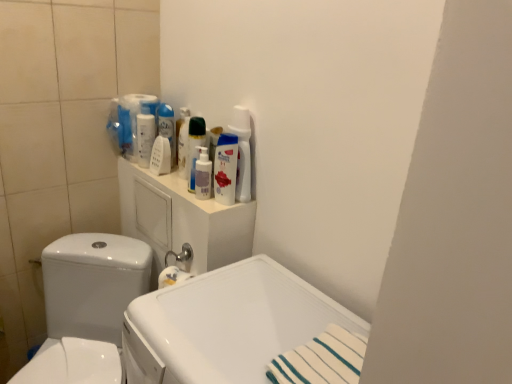
Question: Are white glossy bottle at upper center, which is counted as the 1th cleaning product, starting from the right, and white glossy mouthwash at upper center, marked as the second mouthwash in a right-to-left arrangement, beside each other?

Choices:
 (A) no
 (B) yes

Answer: (A)

Question: Considering the relative sizes of white glossy bottle at upper center, which is counted as the 1th cleaning product, starting from the right, and white glossy mouthwash at upper center, which is the first mouthwash in left-to-right order, in the image provided, is white glossy bottle at upper center, which is counted as the 1th cleaning product, starting from the right, bigger than white glossy mouthwash at upper center, which is the first mouthwash in left-to-right order,?

Choices:
 (A) no
 (B) yes

Answer: (B)

Question: From a real-world perspective, is white glossy bottle at upper center, acting as the fourth cleaning product starting from the left, physically above white glossy mouthwash at upper center, which is the first mouthwash in left-to-right order?

Choices:
 (A) yes
 (B) no

Answer: (B)

Question: Is white glossy bottle at upper center, which is counted as the 1th cleaning product, starting from the right, surrounding white glossy mouthwash at upper center, which is the first mouthwash in left-to-right order?

Choices:
 (A) no
 (B) yes

Answer: (A)

Question: Is white glossy bottle at upper center, acting as the fourth cleaning product starting from the left, facing towards white glossy mouthwash at upper center, which is the first mouthwash in left-to-right order?

Choices:
 (A) no
 (B) yes

Answer: (A)

Question: From a real-world perspective, is white glossy bottle at upper center, which is counted as the 1th cleaning product, starting from the right, under white glossy mouthwash at upper center, which appears as the second mouthwash when viewed from the front?

Choices:
 (A) yes
 (B) no

Answer: (A)

Question: Can you confirm if white plastic medicine cabinet at upper center is positioned to the right of white glossy mouthwash at upper center, which appears as the second mouthwash when viewed from the front?

Choices:
 (A) no
 (B) yes

Answer: (B)

Question: From a real-world perspective, is white plastic medicine cabinet at upper center on white glossy mouthwash at upper center, which is the first mouthwash in left-to-right order?

Choices:
 (A) no
 (B) yes

Answer: (A)

Question: Does white plastic medicine cabinet at upper center turn towards white glossy mouthwash at upper center, which is the first mouthwash in left-to-right order?

Choices:
 (A) yes
 (B) no

Answer: (B)

Question: Is white plastic medicine cabinet at upper center shorter than white glossy mouthwash at upper center, which is the first mouthwash in left-to-right order?

Choices:
 (A) yes
 (B) no

Answer: (B)

Question: From the image's perspective, does white plastic medicine cabinet at upper center appear higher than white glossy mouthwash at upper center, positioned as the 1th mouthwash in back-to-front order?

Choices:
 (A) no
 (B) yes

Answer: (A)

Question: Considering the relative sizes of white plastic medicine cabinet at upper center and white glossy mouthwash at upper center, positioned as the 1th mouthwash in back-to-front order, in the image provided, is white plastic medicine cabinet at upper center smaller than white glossy mouthwash at upper center, positioned as the 1th mouthwash in back-to-front order,?

Choices:
 (A) no
 (B) yes

Answer: (A)

Question: Is white plastic medicine cabinet at upper center surrounded by white glossy spray bottle at upper center, which is counted as the first cleaning product, starting from the left?

Choices:
 (A) yes
 (B) no

Answer: (B)